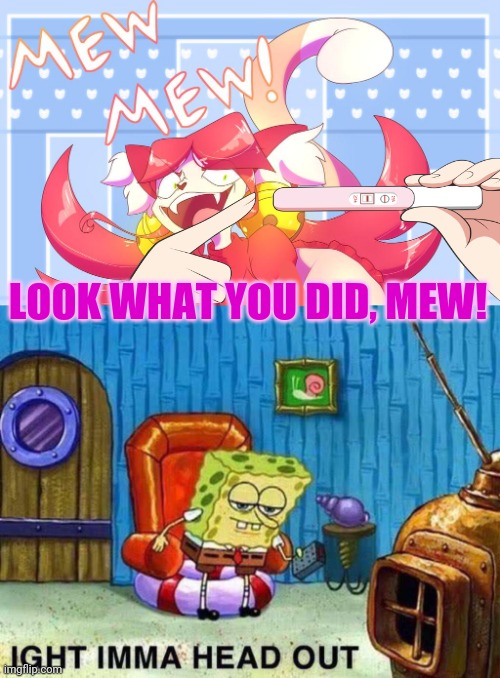
Identify the location of frame. The height and width of the screenshot is (678, 500). (282, 399).